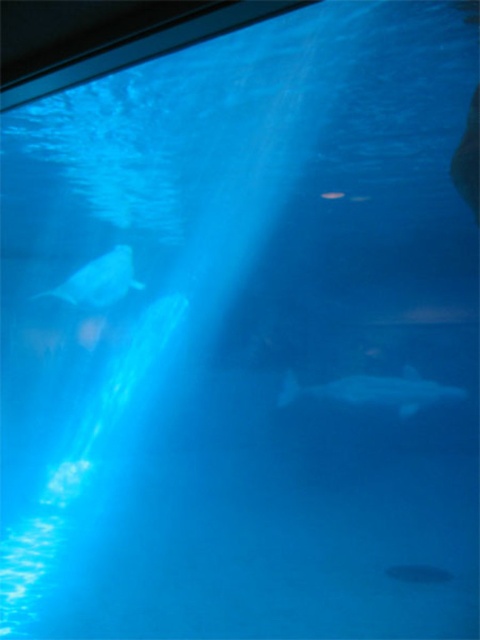
Between point (395, 403) and point (106, 285), which one is positioned behind?

The point (395, 403) is behind.

Does point (312, 394) come farther from viewer compared to point (110, 257)?

Yes, point (312, 394) is farther from viewer.

Is point (332, 388) positioned behind point (126, 257)?

Yes.

Image resolution: width=480 pixels, height=640 pixels. Identify the location of translucent white shark at lower center. (373, 392).